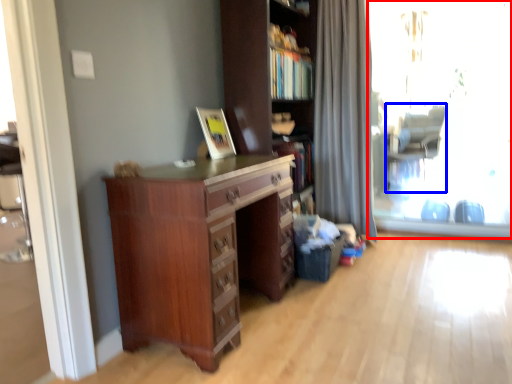
Question: Among these objects, which one is farthest to the camera, window screen (highlighted by a red box) or swivel chair (highlighted by a blue box)?

Choices:
 (A) window screen
 (B) swivel chair

Answer: (B)